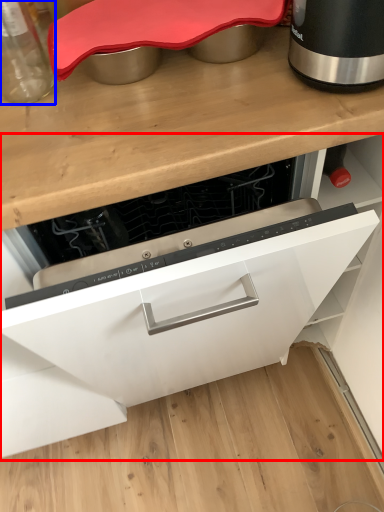
Question: Which of the following is the farthest to the observer, cabinetry (highlighted by a red box) or kitchen appliance (highlighted by a blue box)?

Choices:
 (A) cabinetry
 (B) kitchen appliance

Answer: (B)